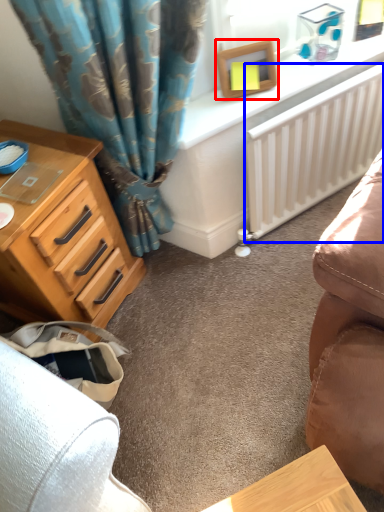
Question: Which object is closer to the camera taking this photo, picture frame (highlighted by a red box) or radiator (highlighted by a blue box)?

Choices:
 (A) picture frame
 (B) radiator

Answer: (A)